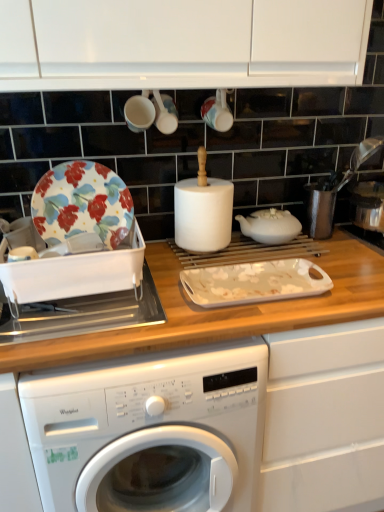
Question: Based on their sizes in the image, would you say white glossy cup at upper center, positioned as the 2th tableware in left-to-right order, is bigger or smaller than floral-patterned ceramic plate at left?

Choices:
 (A) big
 (B) small

Answer: (B)

Question: Looking at their shapes, would you say white glossy cup at upper center, the 2th tableware in the right-to-left sequence, is wider or thinner than floral-patterned ceramic plate at left?

Choices:
 (A) wide
 (B) thin

Answer: (A)

Question: Which object is the farthest from the white glossy cup at upper center, positioned as the 2th tableware in left-to-right order?

Choices:
 (A) wooden at center
 (B) matte ceramic cup at upper center, positioned as the 3th tableware in left-to-right order
 (C) white plastic dish rack at left
 (D) matte white cup at upper center, the first tableware when ordered from left to right
 (E) floral-patterned ceramic plate at left

Answer: (A)

Question: Estimate the real-world distances between objects in this image. Which object is farther from the wooden at center?

Choices:
 (A) white glossy baking sheet at center
 (B) matte white cup at upper center, which is the 3th tableware in right-to-left order
 (C) floral-patterned ceramic plate at left
 (D) white glossy cup at upper center, the 2th tableware in the right-to-left sequence
 (E) white plastic dish rack at left

Answer: (B)